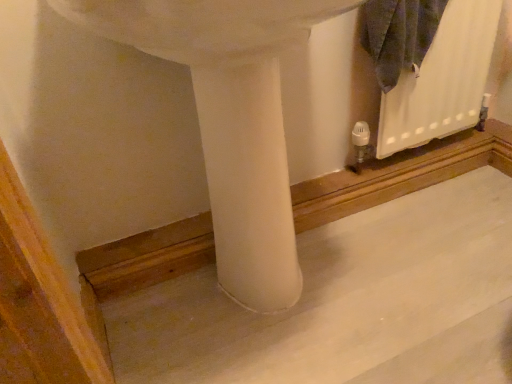
Where is `vacant area that lies to the right of white matte sink at center`? This screenshot has height=384, width=512. vacant area that lies to the right of white matte sink at center is located at coordinates (425, 269).